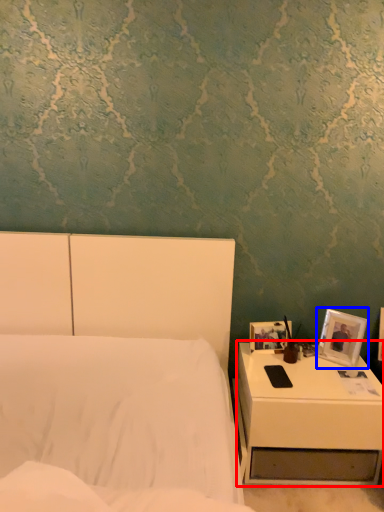
Question: Which of the following is the closest to the observer, nightstand (highlighted by a red box) or picture frame (highlighted by a blue box)?

Choices:
 (A) nightstand
 (B) picture frame

Answer: (A)